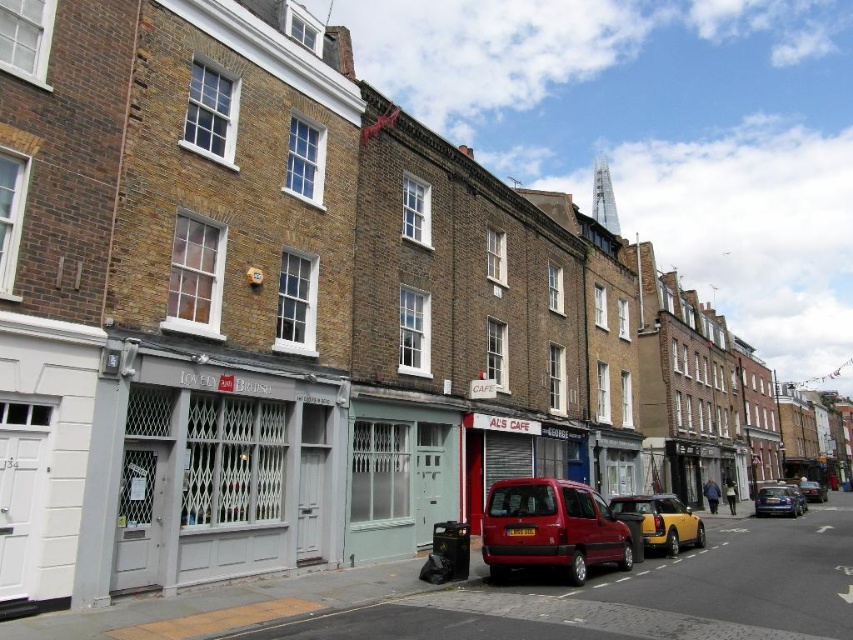
You are standing on the sidewalk in the residential area and see two points marked on the street. The first point is at coordinates point (283, 502) and the second is at point (793, 497). If you are facing the direction of the street, which point is closer to you?

Point (283, 502) is in front of point (793, 497), so the first point is closer to you.